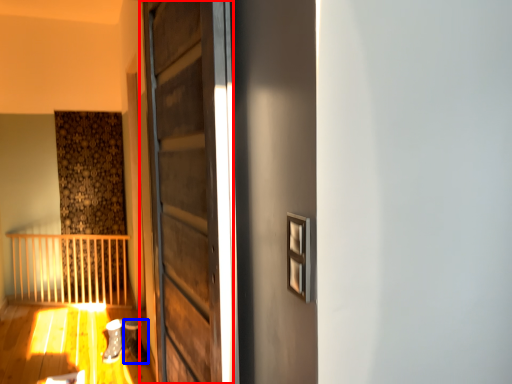
Question: Which object is closer to the camera taking this photo, door (highlighted by a red box) or shoe (highlighted by a blue box)?

Choices:
 (A) door
 (B) shoe

Answer: (A)